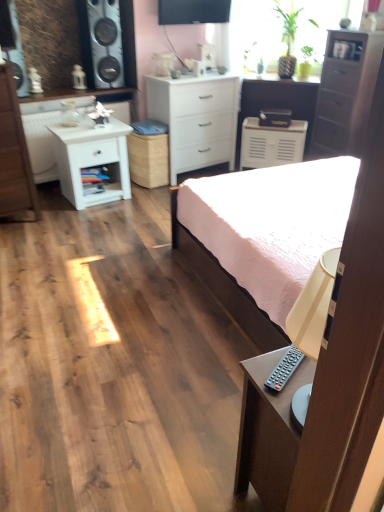
This screenshot has height=512, width=384. Find the location of `vacant space situated on the left part of pink fabric bed at center`. vacant space situated on the left part of pink fabric bed at center is located at coordinates 105,306.